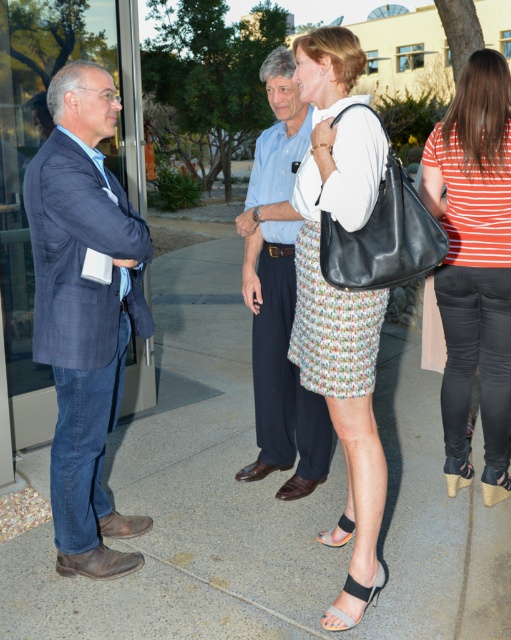
Is blue denim jeans at left smaller than black leather sandal at lower center?

No.

Between point (107, 298) and point (338, 525), which one is positioned behind?

The point (338, 525) is behind.

Is point (96, 548) in front of point (318, 538)?

Yes, it is in front of point (318, 538).

Where is `blue denim jeans at left`? Image resolution: width=511 pixels, height=640 pixels. blue denim jeans at left is located at coordinates (84, 312).

Is brown leather shoes at center bigger than black leather sandal at lower center?

Indeed, brown leather shoes at center has a larger size compared to black leather sandal at lower center.

Between point (282, 388) and point (320, 536), which one is positioned in front?

Point (320, 536)

Find the location of `brown leather shoes at center`. brown leather shoes at center is located at coordinates (278, 294).

Between leather wedge sandal at lower right and black leather sandal at lower center, which one has less height?

With less height is black leather sandal at lower center.

Which is below, leather wedge sandal at lower right or black leather sandal at lower center?

black leather sandal at lower center is lower down.

I want to click on leather wedge sandal at lower right, so click(495, 484).